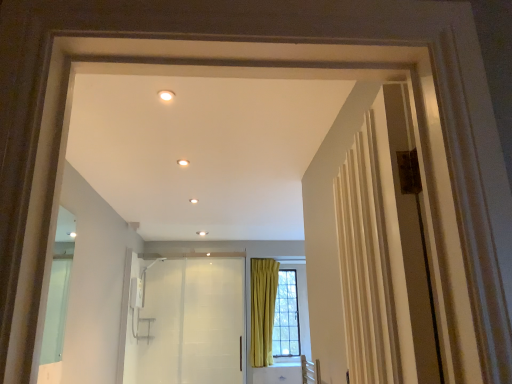
Where is `clear glass window at center`? The image size is (512, 384). clear glass window at center is located at coordinates (286, 316).

This screenshot has height=384, width=512. What do you see at coordinates (286, 316) in the screenshot? I see `clear glass window at center` at bounding box center [286, 316].

Measure the distance between point (231, 274) and camera.

They are 18.61 feet apart.

In the scene shown: Measure the distance between white glossy elevator at center and camera.

white glossy elevator at center is 4.62 meters from camera.

What do you see at coordinates (188, 323) in the screenshot?
I see `white glossy elevator at center` at bounding box center [188, 323].

I want to click on white glossy elevator at center, so click(x=188, y=323).

Locate an element on the screen. The width and height of the screenshot is (512, 384). clear glass window at center is located at coordinates [x=286, y=316].

Is clear glass window at center at the left side of white glossy elevator at center?

In fact, clear glass window at center is to the right of white glossy elevator at center.

Considering the positions of objects clear glass window at center and white glossy elevator at center in the image provided, who is behind, clear glass window at center or white glossy elevator at center?

clear glass window at center is further from the camera.

Which is closer, (280,276) or (228,300)?

The point (228,300) is closer.

From the image's perspective, relative to white glossy elevator at center, is clear glass window at center above or below?

Based on their image positions, clear glass window at center is located beneath white glossy elevator at center.

From a real-world perspective, who is located lower, clear glass window at center or white glossy elevator at center?

white glossy elevator at center.

Which object is thinner, clear glass window at center or white glossy elevator at center?

Thinner between the two is white glossy elevator at center.

Considering the sizes of objects clear glass window at center and white glossy elevator at center in the image provided, who is taller, clear glass window at center or white glossy elevator at center?

white glossy elevator at center is taller.

Considering the sizes of objects clear glass window at center and white glossy elevator at center in the image provided, who is smaller, clear glass window at center or white glossy elevator at center?

With smaller size is white glossy elevator at center.

Is clear glass window at center surrounding white glossy elevator at center?

No, white glossy elevator at center is not surrounded by clear glass window at center.

Does clear glass window at center touch white glossy elevator at center?

No, clear glass window at center is not with white glossy elevator at center.

Does clear glass window at center turn towards white glossy elevator at center?

No, clear glass window at center is not aimed at white glossy elevator at center.

What's the angular difference between clear glass window at center and white glossy elevator at center's facing directions?

clear glass window at center and white glossy elevator at center are facing 0.713 degrees away from each other.

You are a GUI agent. You are given a task and a screenshot of the screen. Output one action in this format:
    pyautogui.click(x=<x>, y=<y>)
    Task: Click on the window that is behind the white glossy elevator at center
    Image resolution: width=512 pixels, height=384 pixels.
    Given the screenshot: What is the action you would take?
    pyautogui.click(x=286, y=316)

Is white glossy elevator at center at the right side of clear glass window at center?

No, white glossy elevator at center is not to the right of clear glass window at center.

Which object is closer to the camera, white glossy elevator at center or clear glass window at center?

white glossy elevator at center is in front.

Is point (138, 361) closer or farther from the camera than point (290, 306)?

Point (138, 361).

From the image's perspective, is white glossy elevator at center located beneath clear glass window at center?

No, from the image's perspective, white glossy elevator at center is not beneath clear glass window at center.

From a real-world perspective, is white glossy elevator at center above or below clear glass window at center?

In terms of real-world spatial position, white glossy elevator at center is below clear glass window at center.

Between white glossy elevator at center and clear glass window at center, which one has larger width?

With larger width is clear glass window at center.

Considering the relative sizes of white glossy elevator at center and clear glass window at center in the image provided, is white glossy elevator at center taller than clear glass window at center?

Yes, white glossy elevator at center is taller than clear glass window at center.

Considering the relative sizes of white glossy elevator at center and clear glass window at center in the image provided, is white glossy elevator at center bigger than clear glass window at center?

No, white glossy elevator at center is not bigger than clear glass window at center.

Is white glossy elevator at center not inside clear glass window at center?

Yes, white glossy elevator at center is located beyond the bounds of clear glass window at center.

Are white glossy elevator at center and clear glass window at center located far from each other?

Yes, white glossy elevator at center and clear glass window at center are located far from each other.

Is clear glass window at center at the back of white glossy elevator at center?

That's not correct — white glossy elevator at center is not looking away from clear glass window at center.

Can you tell me how much white glossy elevator at center and clear glass window at center differ in facing direction?

The angle between the facing direction of white glossy elevator at center and the facing direction of clear glass window at center is 0.713 degrees.

Where is `window behind the white glossy elevator at center`? The image size is (512, 384). window behind the white glossy elevator at center is located at coordinates (286, 316).

Image resolution: width=512 pixels, height=384 pixels. Identify the location of window below the white glossy elevator at center (from the image's perspective). (286, 316).

Find the location of a particular element. Image resolution: width=512 pixels, height=384 pixels. window that is behind the white glossy elevator at center is located at coordinates (286, 316).